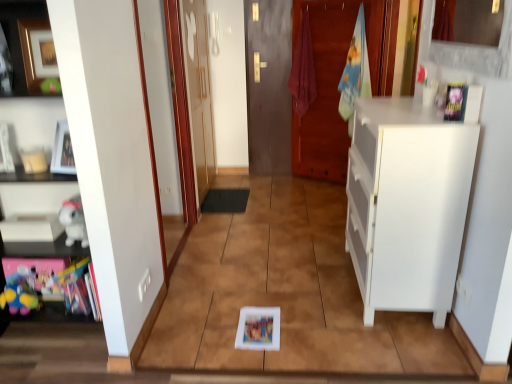
Question: Should I look upward or downward to see matte white picture frame at upper left?

Choices:
 (A) down
 (B) up

Answer: (B)

Question: Could you tell me if white matte cabinet at left, the 1th cabinetry positioned from the left, is turned towards black rubber mat at center?

Choices:
 (A) no
 (B) yes

Answer: (A)

Question: Does white matte cabinet at left, the 1th cabinetry positioned from the left, have a greater width compared to black rubber mat at center?

Choices:
 (A) yes
 (B) no

Answer: (B)

Question: Is white matte cabinet at left, marked as the 2th cabinetry in a right-to-left arrangement, thinner than black rubber mat at center?

Choices:
 (A) no
 (B) yes

Answer: (B)

Question: Does white matte cabinet at left, marked as the 2th cabinetry in a right-to-left arrangement, have a lesser height compared to black rubber mat at center?

Choices:
 (A) yes
 (B) no

Answer: (B)

Question: Can you confirm if white matte cabinet at left, the 1th cabinetry positioned from the left, is taller than black rubber mat at center?

Choices:
 (A) yes
 (B) no

Answer: (A)

Question: Is white matte cabinet at left, marked as the 2th cabinetry in a right-to-left arrangement, smaller than black rubber mat at center?

Choices:
 (A) yes
 (B) no

Answer: (B)

Question: From the image's perspective, is matte white picture frame at upper left beneath white matte cabinet at right, the first cabinetry viewed from the right?

Choices:
 (A) no
 (B) yes

Answer: (A)

Question: Can you confirm if matte white picture frame at upper left is taller than white matte cabinet at right, the first cabinetry viewed from the right?

Choices:
 (A) yes
 (B) no

Answer: (B)

Question: Does matte white picture frame at upper left have a larger size compared to white matte cabinet at right, the first cabinetry viewed from the right?

Choices:
 (A) no
 (B) yes

Answer: (A)

Question: Considering the relative sizes of matte white picture frame at upper left and white matte cabinet at right, the first cabinetry viewed from the right, in the image provided, is matte white picture frame at upper left thinner than white matte cabinet at right, the first cabinetry viewed from the right,?

Choices:
 (A) no
 (B) yes

Answer: (B)

Question: Is matte white picture frame at upper left oriented towards white matte cabinet at right, the 2th cabinetry when ordered from left to right?

Choices:
 (A) yes
 (B) no

Answer: (B)

Question: Is matte white picture frame at upper left positioned behind white matte cabinet at right, the 2th cabinetry when ordered from left to right?

Choices:
 (A) yes
 (B) no

Answer: (A)

Question: From the image's perspective, is multicolored plush toy at lower left, marked as the first toy in a left-to-right arrangement, located above black rubber mat at center?

Choices:
 (A) no
 (B) yes

Answer: (A)